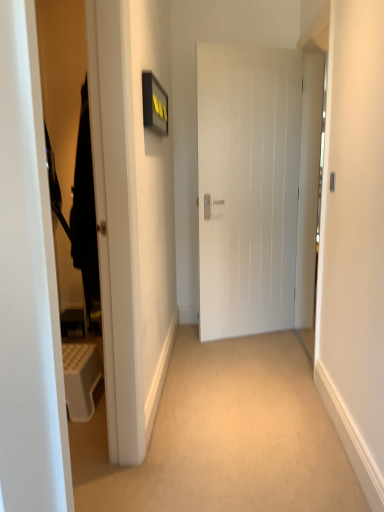
Question: Is white matte door at center at the left side of satin silver door handle at center?

Choices:
 (A) no
 (B) yes

Answer: (B)

Question: Is white matte door at center directly adjacent to satin silver door handle at center?

Choices:
 (A) yes
 (B) no

Answer: (B)

Question: Is satin silver door handle at center completely or partially inside white matte door at center?

Choices:
 (A) no
 (B) yes

Answer: (A)

Question: Does white matte door at center turn towards satin silver door handle at center?

Choices:
 (A) no
 (B) yes

Answer: (B)

Question: Is white matte door at center closer to the viewer compared to satin silver door handle at center?

Choices:
 (A) yes
 (B) no

Answer: (B)

Question: Is white matte door at center looking in the opposite direction of satin silver door handle at center?

Choices:
 (A) no
 (B) yes

Answer: (B)

Question: Can white matte door at center be found inside black fabric robe at left?

Choices:
 (A) no
 (B) yes

Answer: (A)

Question: From a real-world perspective, is black fabric robe at left located beneath white matte door at center?

Choices:
 (A) yes
 (B) no

Answer: (B)

Question: Is black fabric robe at left wider than white matte door at center?

Choices:
 (A) no
 (B) yes

Answer: (B)

Question: Is black fabric robe at left outside of white matte door at center?

Choices:
 (A) yes
 (B) no

Answer: (A)

Question: Is black fabric robe at left not close to white matte door at center?

Choices:
 (A) no
 (B) yes

Answer: (B)

Question: Considering the relative sizes of black fabric robe at left and white matte door at center in the image provided, is black fabric robe at left bigger than white matte door at center?

Choices:
 (A) yes
 (B) no

Answer: (B)

Question: From the image's perspective, is satin silver door handle at center below white matte door at center?

Choices:
 (A) yes
 (B) no

Answer: (A)